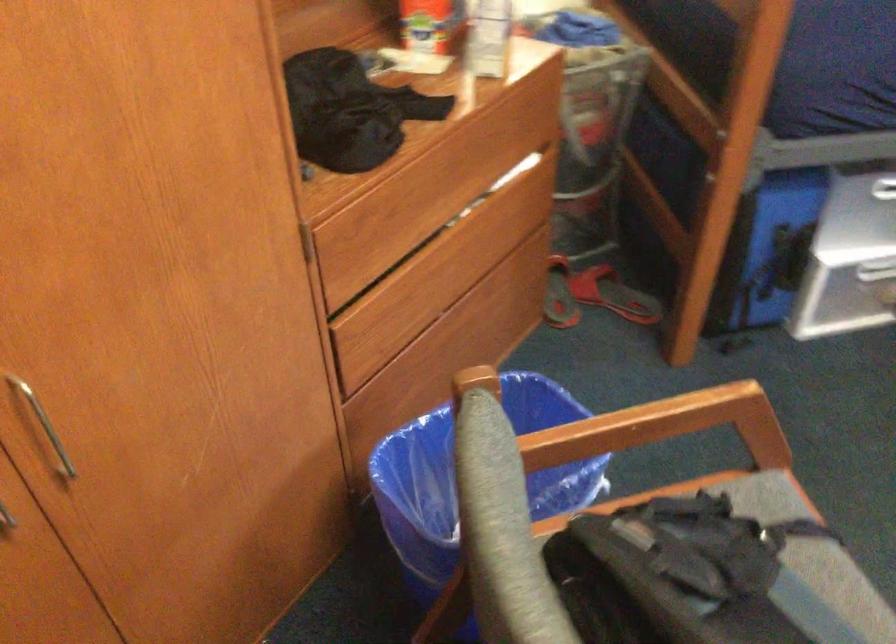
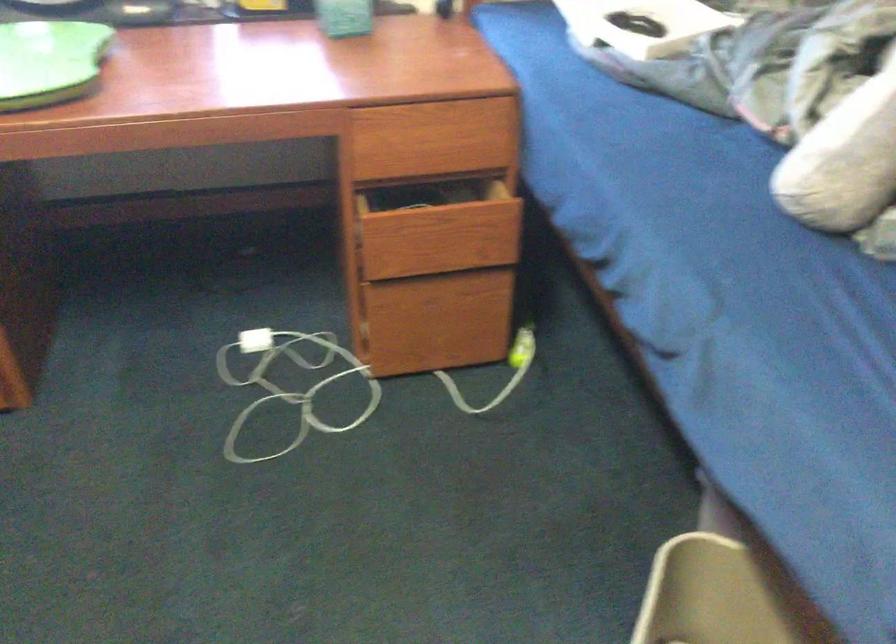
Based on the continuous images, in which direction is the camera rotating?

The camera rotated toward right-down.